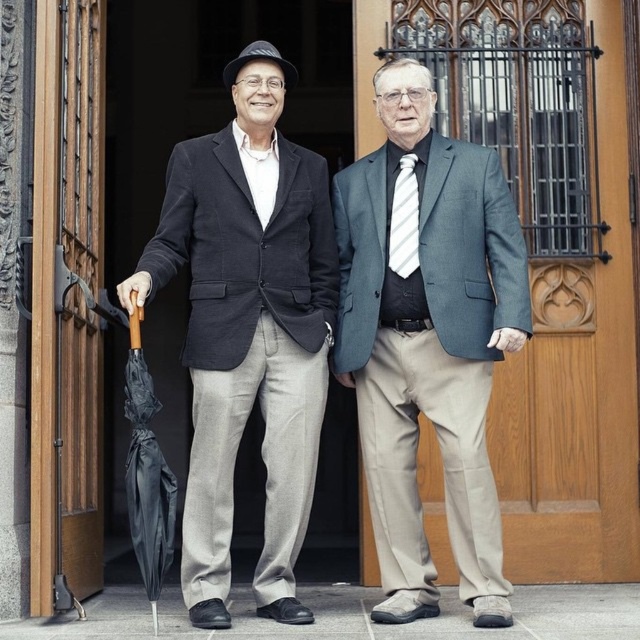
You are a fashion designer observing two items in the scene. The dark gray wool blazer at left and the black matte umbrella at left. Which item is taller?

The dark gray wool blazer at left is much taller than the black matte umbrella at left.

You are a fashion designer observing two people in the image. The first person is wearing a matte black suit at center, and the second is holding a black matte umbrella at left. Which one is positioned more to the right?

The matte black suit at center is positioned more to the right because it is on the right side of the black matte umbrella at left.

You are a delivery person trying to determine the best path to the front door. You notice two points marked on the ground near the wooden door with intricate metalwork. The first point is labeled as point [224,353] and the second as point [145,454]. Which point should you avoid stepping on if you want to stay closer to the front door?

You should avoid stepping on point [224,353] because it is behind point [145,454], meaning it is farther from the front door.